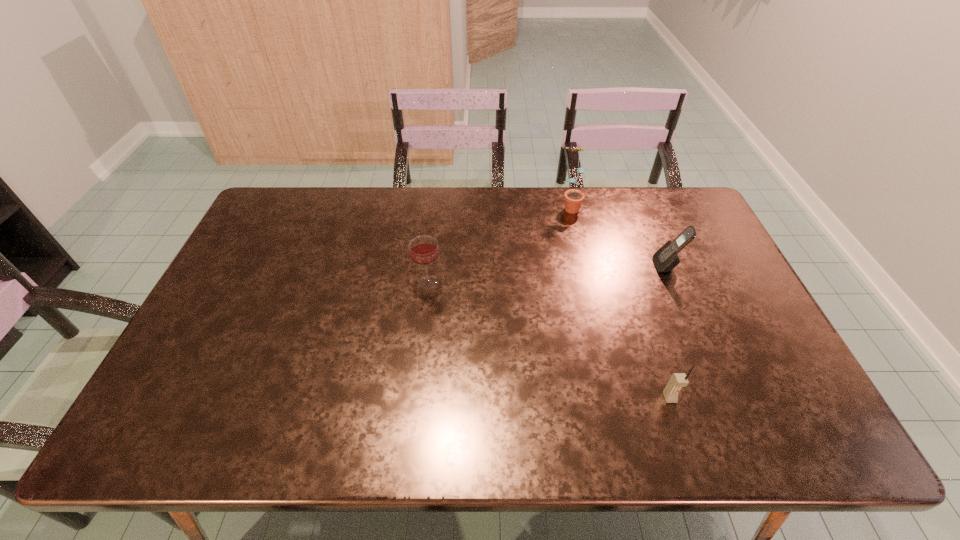
Where is `free space that is in between the tallest object and the wineglass`? The height and width of the screenshot is (540, 960). free space that is in between the tallest object and the wineglass is located at coordinates (499, 244).

This screenshot has height=540, width=960. In order to click on free space between the leftmost object and the nearest object in this screenshot , I will do `click(549, 340)`.

At what (x,y) coordinates should I click in order to perform the action: click on vacant area that lies between the wineglass and the right cellular telephone. Please return your answer as a coordinate pair (x, y). Image resolution: width=960 pixels, height=540 pixels. Looking at the image, I should click on (547, 274).

This screenshot has width=960, height=540. Identify the location of free spot between the second object from left to right and the third object from left to right. (620, 302).

The image size is (960, 540). Find the location of `vacant point located between the leftmost object and the third object from left to right`. vacant point located between the leftmost object and the third object from left to right is located at coordinates (549, 340).

This screenshot has height=540, width=960. I want to click on free space between the leftmost object and the nearer cellular telephone, so click(x=549, y=340).

At what (x,y) coordinates should I click in order to perform the action: click on unoccupied position between the wineglass and the nearest object. Please return your answer as a coordinate pair (x, y). Looking at the image, I should click on (549, 340).

In order to click on vacant area that lies between the nearer cellular telephone and the wineglass in this screenshot , I will do `click(549, 340)`.

Locate an element on the screen. vacant space that's between the nearest object and the rightmost object is located at coordinates (668, 332).

Identify which object is located as the nearest to the wineglass. Please provide its 2D coordinates. Your answer should be formatted as a tuple, i.e. [(x, y)], where the tuple contains the x and y coordinates of a point satisfying the conditions above.

[(573, 198)]